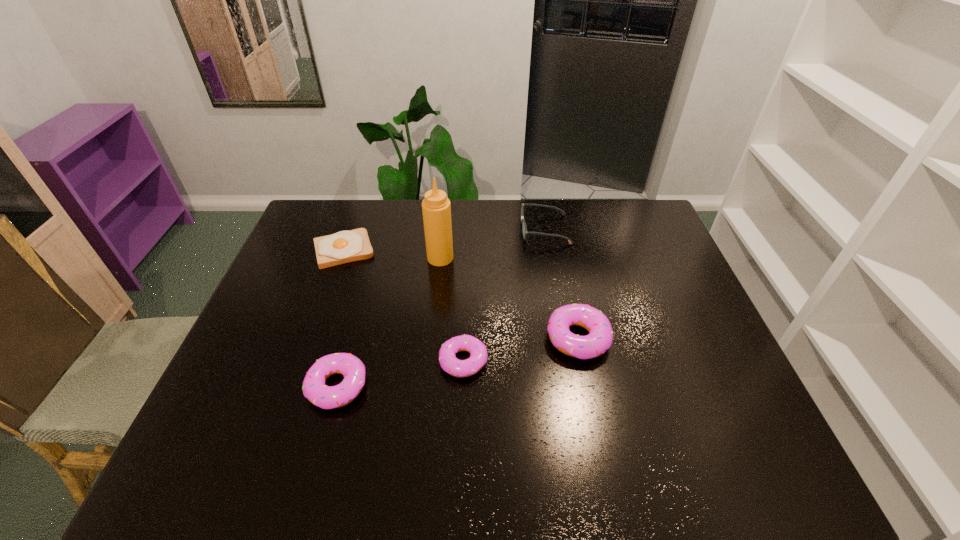
This screenshot has height=540, width=960. Identify the location of vacant position in the image that satisfies the following two spatial constraints: 1. on the back side of the shortest doughnut; 2. on the right side of the rightmost doughnut. (465, 338).

Image resolution: width=960 pixels, height=540 pixels. What are the coordinates of `vacant area that satisfies the following two spatial constraints: 1. on the face of the rightmost doughnut; 2. on the left side of the spectacles` in the screenshot? It's located at (564, 338).